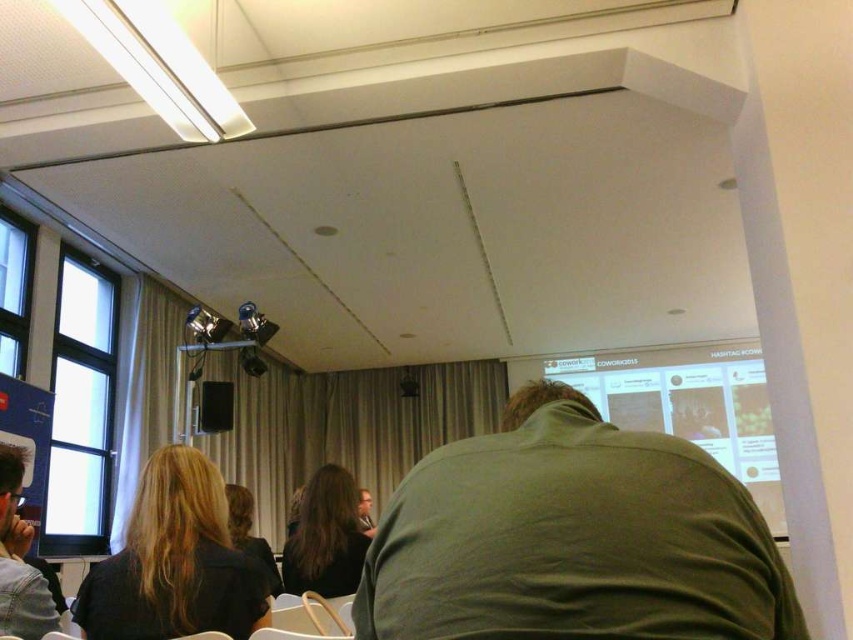
You are standing in the conference room and want to take a photo of the point at coordinates point [38,573]. The camera you have can only focus on objects within 1.5 meters. Will the camera be able to focus on the point?

The point [38,573] is 1.39 meters away from the camera, which is within the 1.5 meters focusing range. Therefore, the camera can focus on the point.

You are an attendee at the presentation and want to see the person in the matte black jacket at lower left and the matte black shirt at center clearly. Which one is easier to see from your current position?

The matte black jacket at lower left is larger in size than the matte black shirt at center, so it is easier to see from your current position.